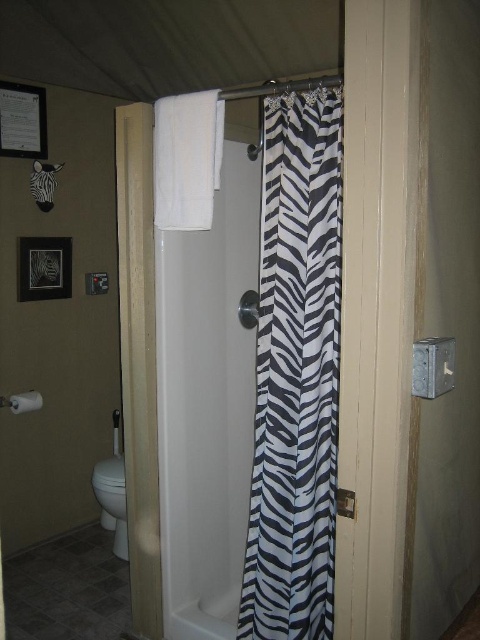
Who is taller, zebra-patterned fabric at center or white matte towel bar at upper center?

zebra-patterned fabric at center

Who is shorter, zebra-patterned fabric at center or white matte towel bar at upper center?

Standing shorter between the two is white matte towel bar at upper center.

Between point (333, 269) and point (24, 397), which one is positioned behind?

Point (24, 397)

Where is `zebra-patterned fabric at center`? zebra-patterned fabric at center is located at coordinates (296, 372).

Does point (127, 554) come closer to viewer compared to point (37, 403)?

No, it is not.

Is white glossy toilet bowl at lower left below white matte towel bar at upper center?

Yes.

Between point (94, 477) and point (33, 396), which one is positioned behind?

The point (94, 477) is behind.

Locate an element on the screen. white glossy toilet bowl at lower left is located at coordinates (112, 499).

Does point (253, 531) lie in front of point (115, 499)?

That is True.

Is zebra-patterned fabric at center taller than white glossy toilet bowl at lower left?

Yes.

At what (x,y) coordinates should I click in order to perform the action: click on zebra-patterned fabric at center. Please return your answer as a coordinate pair (x, y). Image resolution: width=480 pixels, height=640 pixels. Looking at the image, I should click on (296, 372).

Find the location of `zebra-patterned fabric at center`. zebra-patterned fabric at center is located at coordinates (296, 372).